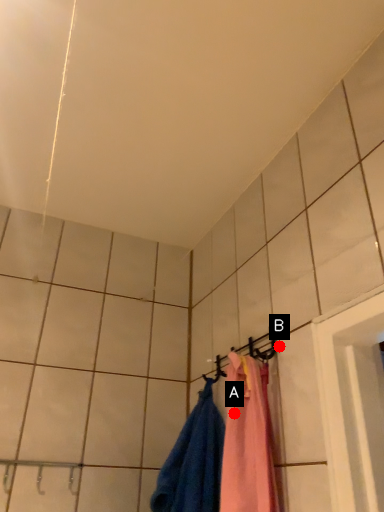
Question: Two points are circled on the image, labeled by A and B beside each circle. Which of the following is the closest to the observer?

Choices:
 (A) A is closer
 (B) B is closer

Answer: (B)